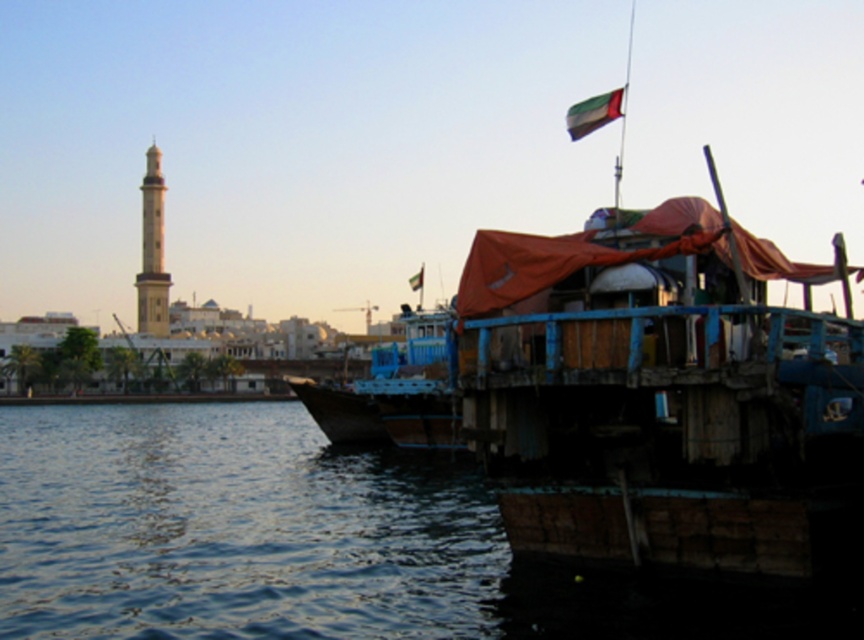
Question: Which point is closer to the camera taking this photo?

Choices:
 (A) (58, 600)
 (B) (411, 289)
 (C) (619, 88)
 (D) (147, 164)

Answer: (A)

Question: From the image, what is the correct spatial relationship of transparent water at lower left in relation to green fabric flag at upper right?

Choices:
 (A) below
 (B) above

Answer: (A)

Question: Among these objects, which one is farthest from the camera?

Choices:
 (A) green fabric flag at upper right
 (B) transparent water at lower left
 (C) red fabric flag at upper right

Answer: (C)

Question: Can you confirm if transparent water at lower left is positioned to the left of red fabric flag at upper right?

Choices:
 (A) no
 (B) yes

Answer: (B)

Question: Which object is the closest to the red fabric flag at upper right?

Choices:
 (A) transparent water at lower left
 (B) green fabric flag at upper right
 (C) smooth beige tower at left

Answer: (A)

Question: Is smooth beige tower at left to the left of green fabric flag at upper right from the viewer's perspective?

Choices:
 (A) yes
 (B) no

Answer: (A)